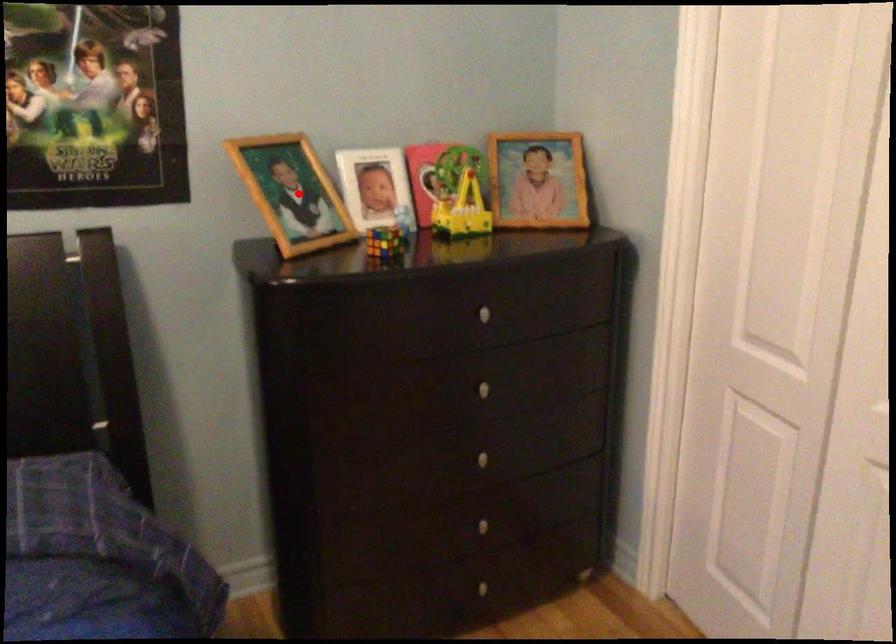
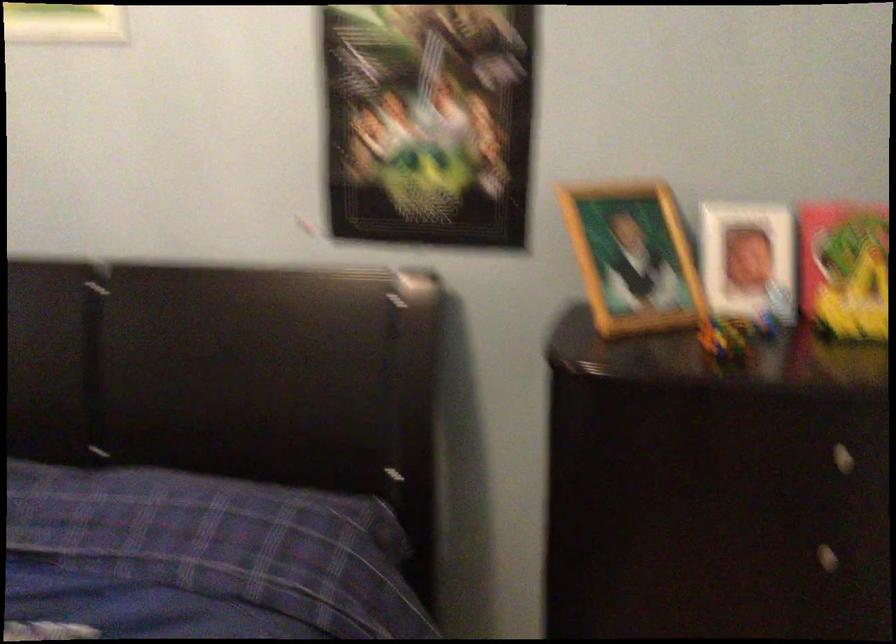
Find the pixel in the second image that matches the highlighted location in the first image.

(633, 258)